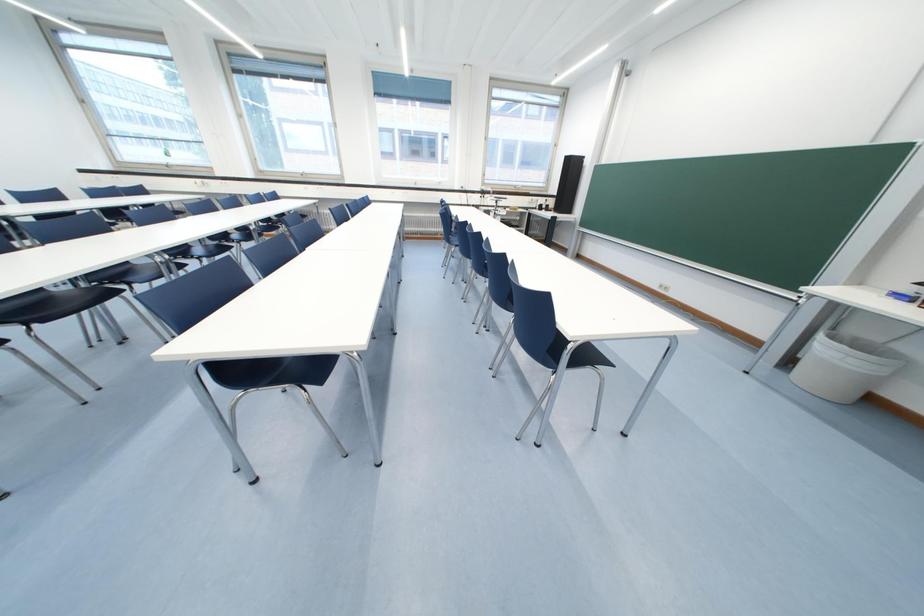
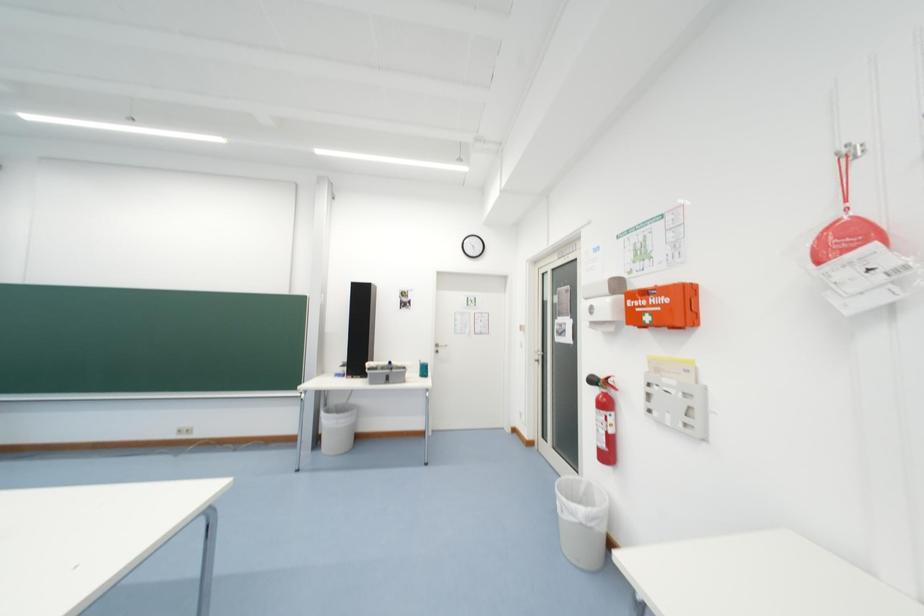
Question: Based on the continuous images, in which direction is the camera rotating? Reply with the corresponding letter.

Choices:
 (A) Left
 (B) Right
 (C) Up
 (D) Down

Answer: (B)